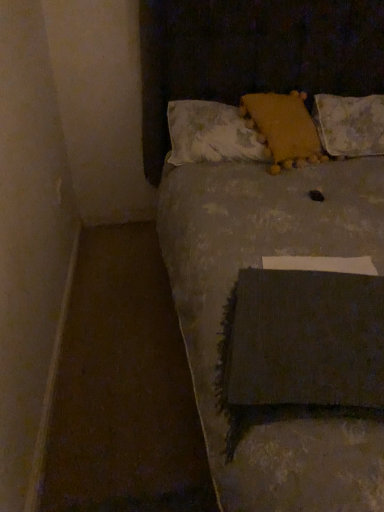
Measure the distance between point (179, 177) and camera.

Point (179, 177) and camera are 1.92 meters apart from each other.

At what (x,y) coordinates should I click in order to perform the action: click on fluffy white pillow at upper center, the 1th pillow when ordered from left to right. Please return your answer as a coordinate pair (x, y). The width and height of the screenshot is (384, 512). Looking at the image, I should click on (211, 134).

From a real-world perspective, is white textured pillow at upper right, the first pillow from the right, physically above fluffy white pillow at upper center, which ranks as the third pillow in right-to-left order?

Incorrect, from a real-world perspective, white textured pillow at upper right, the first pillow from the right, is lower than fluffy white pillow at upper center, which ranks as the third pillow in right-to-left order.

Looking at this image, how far apart are white textured pillow at upper right, the first pillow from the right, and fluffy white pillow at upper center, which ranks as the third pillow in right-to-left order?

19.96 inches.

Is white textured pillow at upper right, the first pillow from the right, placed right next to fluffy white pillow at upper center, which ranks as the third pillow in right-to-left order?

white textured pillow at upper right, the first pillow from the right, and fluffy white pillow at upper center, which ranks as the third pillow in right-to-left order, are not in contact.

Looking at this image, can you confirm if white textured pillow at upper right, which is the third pillow in left-to-right order, is positioned to the left of fluffy white pillow at upper center, which ranks as the third pillow in right-to-left order?

Incorrect, white textured pillow at upper right, which is the third pillow in left-to-right order, is not on the left side of fluffy white pillow at upper center, which ranks as the third pillow in right-to-left order.

Is textured gray blanket at center completely or partially inside white textured pillow at upper right, the first pillow from the right?

No, textured gray blanket at center is not inside white textured pillow at upper right, the first pillow from the right.

Where is `the 1st pillow located above the textured gray blanket at center (from a real-world perspective)`? Image resolution: width=384 pixels, height=512 pixels. the 1st pillow located above the textured gray blanket at center (from a real-world perspective) is located at coordinates (350, 124).

Is white textured pillow at upper right, which is the third pillow in left-to-right order, facing away from textured gray blanket at center?

Correct, white textured pillow at upper right, which is the third pillow in left-to-right order, is looking away from textured gray blanket at center.

The width and height of the screenshot is (384, 512). I want to click on the 3rd pillow directly above the textured gray blanket at center (from a real-world perspective), so click(284, 128).

Would you say yellow fuzzy pillow at upper center, acting as the second pillow starting from the right, is inside or outside textured gray blanket at center?

yellow fuzzy pillow at upper center, acting as the second pillow starting from the right, fits inside textured gray blanket at center.

Is yellow fuzzy pillow at upper center, the second pillow when ordered from left to right, facing away from textured gray blanket at center?

Correct, yellow fuzzy pillow at upper center, the second pillow when ordered from left to right, is looking away from textured gray blanket at center.

Could you tell me if yellow fuzzy pillow at upper center, acting as the second pillow starting from the right, is facing fluffy white pillow at upper center, the 1th pillow when ordered from left to right?

Yes, yellow fuzzy pillow at upper center, acting as the second pillow starting from the right, is aimed at fluffy white pillow at upper center, the 1th pillow when ordered from left to right.

Does yellow fuzzy pillow at upper center, acting as the second pillow starting from the right, have a lesser width compared to fluffy white pillow at upper center, which ranks as the third pillow in right-to-left order?

No.

Considering the sizes of objects yellow fuzzy pillow at upper center, acting as the second pillow starting from the right, and fluffy white pillow at upper center, which ranks as the third pillow in right-to-left order, in the image provided, who is bigger, yellow fuzzy pillow at upper center, acting as the second pillow starting from the right, or fluffy white pillow at upper center, which ranks as the third pillow in right-to-left order,?

With larger size is fluffy white pillow at upper center, which ranks as the third pillow in right-to-left order.

In the scene shown: Is fluffy white pillow at upper center, which ranks as the third pillow in right-to-left order, taller than white textured pillow at upper right, the first pillow from the right?

No.

Is fluffy white pillow at upper center, the 1th pillow when ordered from left to right, to the left of white textured pillow at upper right, which is the third pillow in left-to-right order, from the viewer's perspective?

Yes, fluffy white pillow at upper center, the 1th pillow when ordered from left to right, is to the left of white textured pillow at upper right, which is the third pillow in left-to-right order.

In the scene shown: Considering the relative sizes of fluffy white pillow at upper center, the 1th pillow when ordered from left to right, and white textured pillow at upper right, the first pillow from the right, in the image provided, is fluffy white pillow at upper center, the 1th pillow when ordered from left to right, thinner than white textured pillow at upper right, the first pillow from the right,?

Yes, fluffy white pillow at upper center, the 1th pillow when ordered from left to right, is thinner than white textured pillow at upper right, the first pillow from the right.

Is yellow fuzzy pillow at upper center, acting as the second pillow starting from the right, bigger or smaller than white textured pillow at upper right, which is the third pillow in left-to-right order?

Considering their sizes, yellow fuzzy pillow at upper center, acting as the second pillow starting from the right, takes up less space than white textured pillow at upper right, which is the third pillow in left-to-right order.

Which object is wider, yellow fuzzy pillow at upper center, acting as the second pillow starting from the right, or white textured pillow at upper right, which is the third pillow in left-to-right order?

white textured pillow at upper right, which is the third pillow in left-to-right order, is wider.

From the image's perspective, is yellow fuzzy pillow at upper center, acting as the second pillow starting from the right, positioned above or below white textured pillow at upper right, which is the third pillow in left-to-right order?

yellow fuzzy pillow at upper center, acting as the second pillow starting from the right, is below white textured pillow at upper right, which is the third pillow in left-to-right order.

Considering the sizes of objects yellow fuzzy pillow at upper center, the second pillow when ordered from left to right, and white textured pillow at upper right, the first pillow from the right, in the image provided, who is shorter, yellow fuzzy pillow at upper center, the second pillow when ordered from left to right, or white textured pillow at upper right, the first pillow from the right,?

white textured pillow at upper right, the first pillow from the right, is shorter.

Considering the relative sizes of fluffy white pillow at upper center, which ranks as the third pillow in right-to-left order, and yellow fuzzy pillow at upper center, the second pillow when ordered from left to right, in the image provided, is fluffy white pillow at upper center, which ranks as the third pillow in right-to-left order, wider than yellow fuzzy pillow at upper center, the second pillow when ordered from left to right,?

In fact, fluffy white pillow at upper center, which ranks as the third pillow in right-to-left order, might be narrower than yellow fuzzy pillow at upper center, the second pillow when ordered from left to right.

From a real-world perspective, is fluffy white pillow at upper center, the 1th pillow when ordered from left to right, located higher than yellow fuzzy pillow at upper center, acting as the second pillow starting from the right?

No, from a real-world perspective, fluffy white pillow at upper center, the 1th pillow when ordered from left to right, is not above yellow fuzzy pillow at upper center, acting as the second pillow starting from the right.

Considering the positions of points (208, 131) and (302, 96), is point (208, 131) farther from camera compared to point (302, 96)?

That is False.

Considering the relative sizes of fluffy white pillow at upper center, the 1th pillow when ordered from left to right, and yellow fuzzy pillow at upper center, the second pillow when ordered from left to right, in the image provided, is fluffy white pillow at upper center, the 1th pillow when ordered from left to right, taller than yellow fuzzy pillow at upper center, the second pillow when ordered from left to right,?

No, fluffy white pillow at upper center, the 1th pillow when ordered from left to right, is not taller than yellow fuzzy pillow at upper center, the second pillow when ordered from left to right.

Locate an element on the screen. The width and height of the screenshot is (384, 512). pillow behind the fluffy white pillow at upper center, which ranks as the third pillow in right-to-left order is located at coordinates (350, 124).

Find the location of a particular element. This screenshot has height=512, width=384. furniture below the white textured pillow at upper right, which is the third pillow in left-to-right order (from the image's perspective) is located at coordinates (275, 267).

Considering their positions, is yellow fuzzy pillow at upper center, acting as the second pillow starting from the right, positioned closer to textured gray blanket at center than white textured pillow at upper right, which is the third pillow in left-to-right order?

Among the two, yellow fuzzy pillow at upper center, acting as the second pillow starting from the right, is located nearer to textured gray blanket at center.

When comparing their distances from yellow fuzzy pillow at upper center, acting as the second pillow starting from the right, does white textured pillow at upper right, the first pillow from the right, or fluffy white pillow at upper center, the 1th pillow when ordered from left to right, seem closer?

fluffy white pillow at upper center, the 1th pillow when ordered from left to right, is closer to yellow fuzzy pillow at upper center, acting as the second pillow starting from the right.

Estimate the real-world distances between objects in this image. Which object is further from fluffy white pillow at upper center, which ranks as the third pillow in right-to-left order, yellow fuzzy pillow at upper center, the second pillow when ordered from left to right, or white textured pillow at upper right, the first pillow from the right?

The object further to fluffy white pillow at upper center, which ranks as the third pillow in right-to-left order, is white textured pillow at upper right, the first pillow from the right.

Which object lies nearer to the anchor point fluffy white pillow at upper center, the 1th pillow when ordered from left to right, textured gray blanket at center or yellow fuzzy pillow at upper center, the second pillow when ordered from left to right?

yellow fuzzy pillow at upper center, the second pillow when ordered from left to right, lies closer to fluffy white pillow at upper center, the 1th pillow when ordered from left to right, than the other object.

When comparing their distances from yellow fuzzy pillow at upper center, the second pillow when ordered from left to right, does textured gray blanket at center or white textured pillow at upper right, the first pillow from the right, seem closer?

The object closer to yellow fuzzy pillow at upper center, the second pillow when ordered from left to right, is white textured pillow at upper right, the first pillow from the right.

Considering their positions, is yellow fuzzy pillow at upper center, the second pillow when ordered from left to right, positioned closer to white textured pillow at upper right, which is the third pillow in left-to-right order, than textured gray blanket at center?

yellow fuzzy pillow at upper center, the second pillow when ordered from left to right, lies closer to white textured pillow at upper right, which is the third pillow in left-to-right order, than the other object.

When comparing their distances from textured gray blanket at center, does fluffy white pillow at upper center, the 1th pillow when ordered from left to right, or yellow fuzzy pillow at upper center, acting as the second pillow starting from the right, seem further?

yellow fuzzy pillow at upper center, acting as the second pillow starting from the right, is positioned further to the anchor textured gray blanket at center.

Consider the image. Estimate the real-world distances between objects in this image. Which object is closer to textured gray blanket at center, yellow fuzzy pillow at upper center, acting as the second pillow starting from the right, or fluffy white pillow at upper center, the 1th pillow when ordered from left to right?

fluffy white pillow at upper center, the 1th pillow when ordered from left to right, is positioned closer to the anchor textured gray blanket at center.

Locate an element on the screen. The height and width of the screenshot is (512, 384). pillow between textured gray blanket at center and fluffy white pillow at upper center, the 1th pillow when ordered from left to right, in the front-back direction is located at coordinates (284, 128).

At what (x,y) coordinates should I click in order to perform the action: click on pillow between fluffy white pillow at upper center, the 1th pillow when ordered from left to right, and white textured pillow at upper right, the first pillow from the right, from left to right. Please return your answer as a coordinate pair (x, y). The height and width of the screenshot is (512, 384). Looking at the image, I should click on (284, 128).